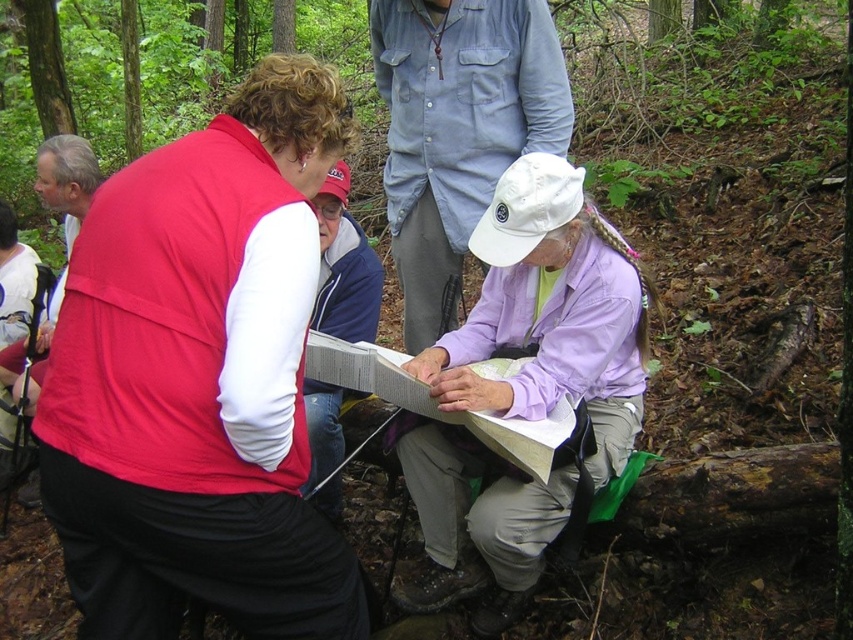
Which is below, lavender fabric shirt at center or blue denim jacket at center?

lavender fabric shirt at center is lower down.

Between lavender fabric shirt at center and blue denim jacket at center, which one has less height?

blue denim jacket at center is shorter.

Image resolution: width=853 pixels, height=640 pixels. What are the coordinates of `lavender fabric shirt at center` in the screenshot? It's located at (550, 314).

Who is positioned more to the right, matte red vest at center or white shirt at upper left?

matte red vest at center is more to the right.

The image size is (853, 640). In order to click on matte red vest at center in this screenshot , I will do `click(200, 380)`.

Between lavender fabric shirt at center and light blue denim shirt at upper center, which one appears on the left side from the viewer's perspective?

Positioned to the left is light blue denim shirt at upper center.

What do you see at coordinates (550, 314) in the screenshot? I see `lavender fabric shirt at center` at bounding box center [550, 314].

Identify the location of lavender fabric shirt at center. [550, 314].